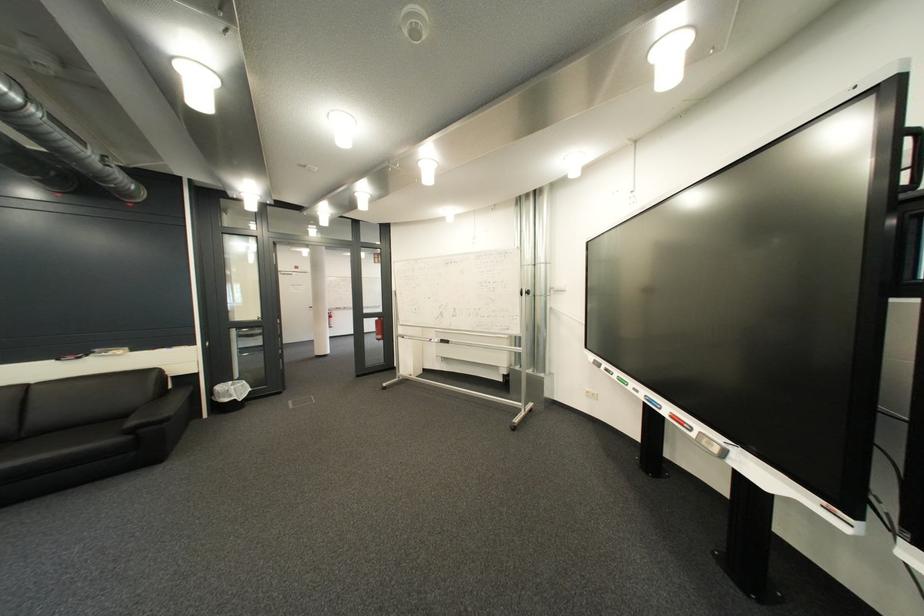
The width and height of the screenshot is (924, 616). I want to click on blue display button, so click(651, 402).